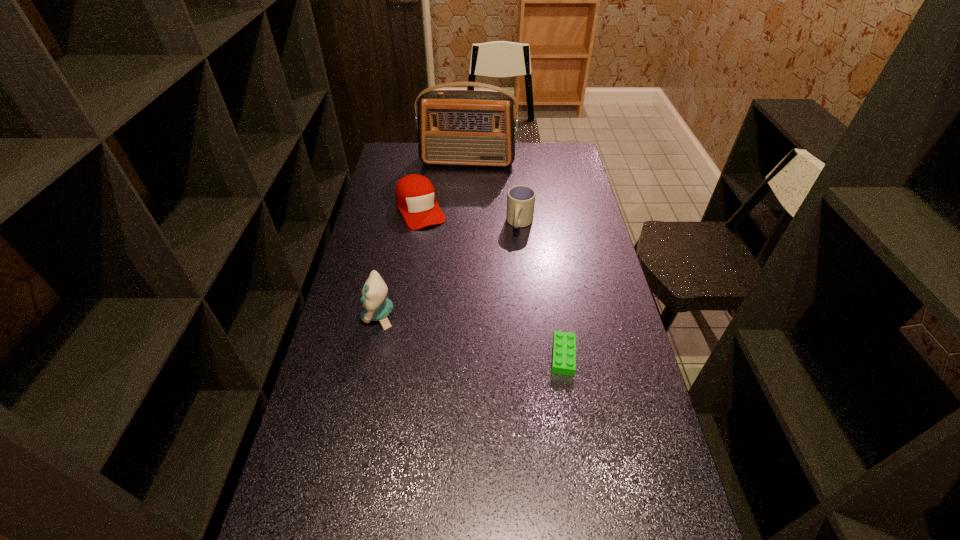
Where is `kitten present at the left edge`? The height and width of the screenshot is (540, 960). kitten present at the left edge is located at coordinates (377, 307).

I want to click on baseball cap positioned at the left edge, so click(x=415, y=196).

Identify the location of free spot at the far edge of the desktop. The image size is (960, 540). (435, 166).

In order to click on vacant space at the near edge of the desktop in this screenshot , I will do [x=353, y=529].

Identify the location of vacant area at the left edge of the desktop. The height and width of the screenshot is (540, 960). (406, 171).

Where is `free space at the right edge of the desktop`? Image resolution: width=960 pixels, height=540 pixels. free space at the right edge of the desktop is located at coordinates tap(620, 387).

What are the coordinates of `vacant space at the near right corner` in the screenshot? It's located at (646, 526).

This screenshot has width=960, height=540. What are the coordinates of `empty space that is in between the cup and the tallest object` in the screenshot? It's located at (493, 192).

Identify the location of free spot between the cup and the nearest object. (541, 290).

Identify the location of free point between the cup and the radio receiver. The height and width of the screenshot is (540, 960). (493, 192).